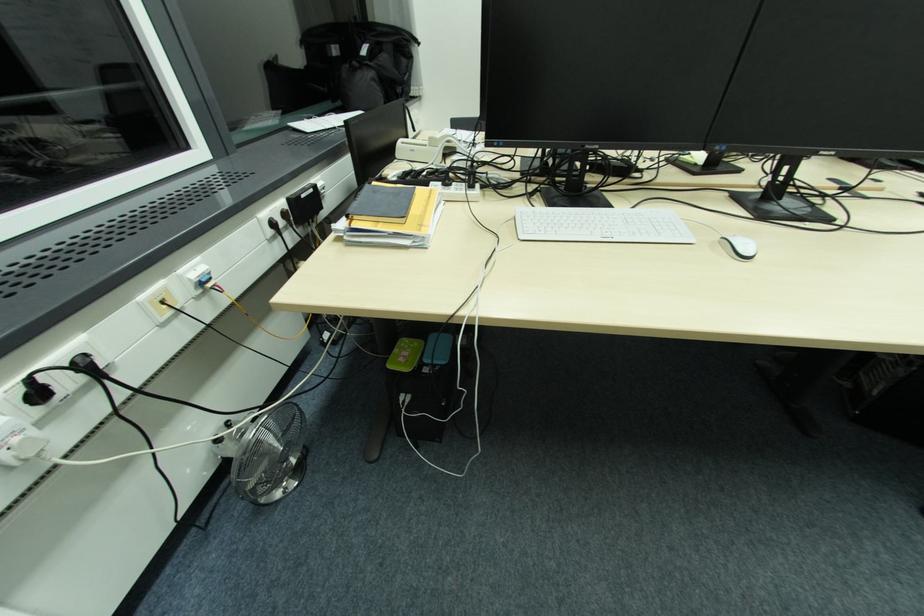
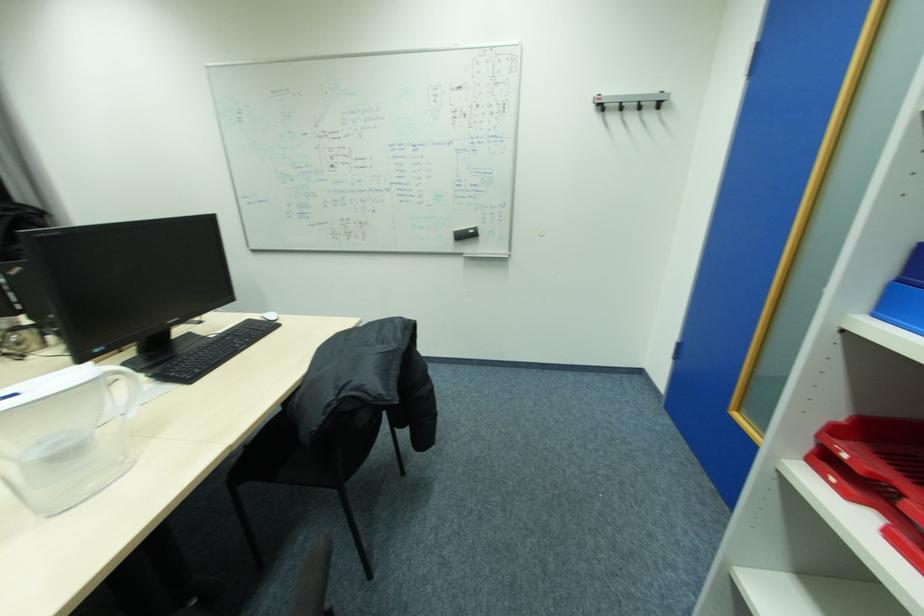
Question: The images are taken continuously from a first-person perspective. In which direction are you moving?

Choices:
 (A) Left
 (B) Right
 (C) Forward
 (D) Backward

Answer: (B)